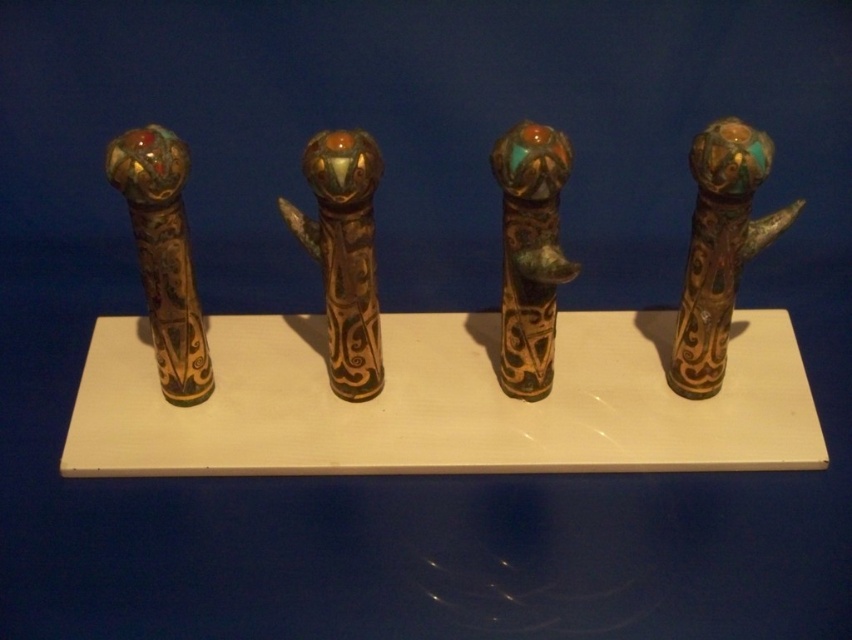
Question: From the image, what is the correct spatial relationship of glossy bronze staff at center in relation to green patinated metal staff at center?

Choices:
 (A) right
 (B) left

Answer: (B)

Question: Based on their relative distances, which object is nearer to the gold-bronze staff at left?

Choices:
 (A) glossy bronze staff at center
 (B) gold patina staff at right
 (C) green patinated metal staff at center

Answer: (A)

Question: Which point is closer to the camera?

Choices:
 (A) green patinated metal staff at center
 (B) glossy bronze staff at center

Answer: (A)

Question: Where is gold patina staff at right located in relation to glossy bronze staff at center in the image?

Choices:
 (A) right
 (B) left

Answer: (A)

Question: Can you confirm if green patinated metal staff at center is smaller than gold-bronze staff at left?

Choices:
 (A) yes
 (B) no

Answer: (B)

Question: Which object is farther from the camera taking this photo?

Choices:
 (A) gold-bronze staff at left
 (B) gold patina staff at right
 (C) green patinated metal staff at center

Answer: (C)